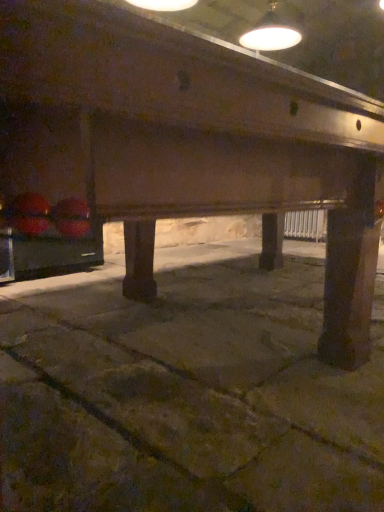
Where is `wooden table at center`? wooden table at center is located at coordinates (191, 144).

Describe the element at coordinates (191, 144) in the screenshot. I see `wooden table at center` at that location.

What is the approximate width of wooden table at center?

The width of wooden table at center is 5.79 feet.

This screenshot has height=512, width=384. Identify the location of wooden table at center. click(191, 144).